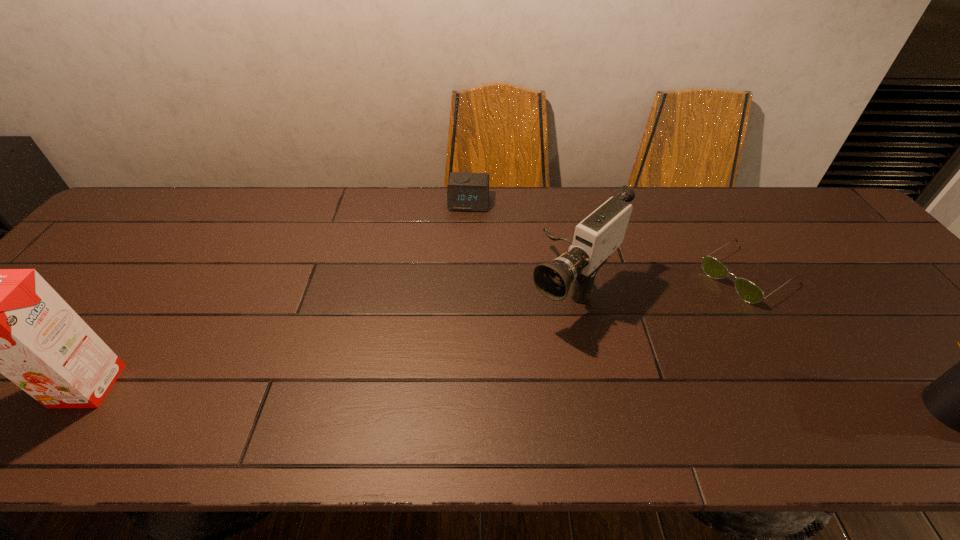
Point out which object is positioned as the fourth nearest to the fourth shortest object. Please provide its 2D coordinates. Your answer should be formatted as a tuple, i.e. [(x, y)], where the tuple contains the x and y coordinates of a point satisfying the conditions above.

[(11, 321)]

Identify the location of object that is the second nearest to the rightmost object. (596, 237).

Locate an element on the screen. vacant space that satisfies the following two spatial constraints: 1. on the front side of the second object from left to right; 2. on the left side of the sunglasses is located at coordinates (467, 275).